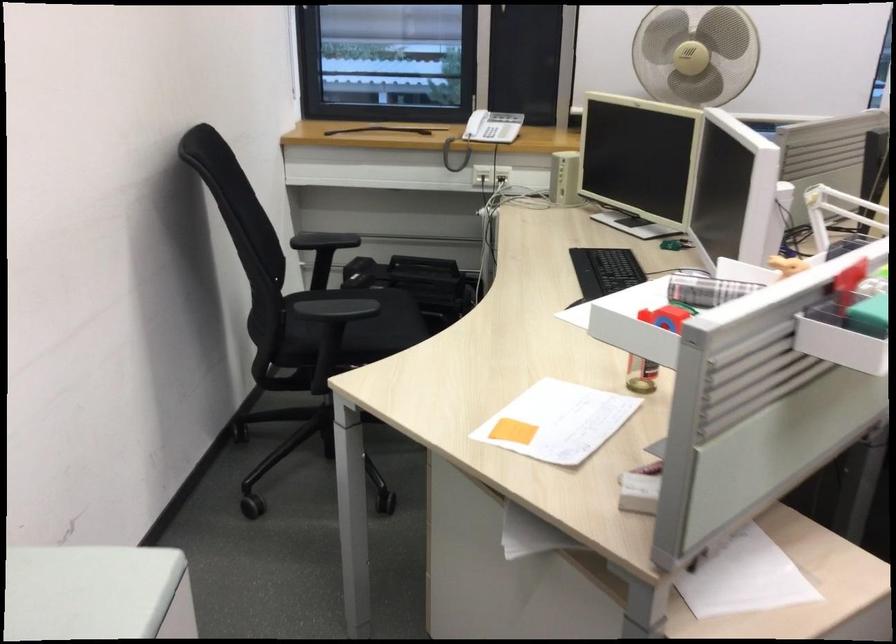
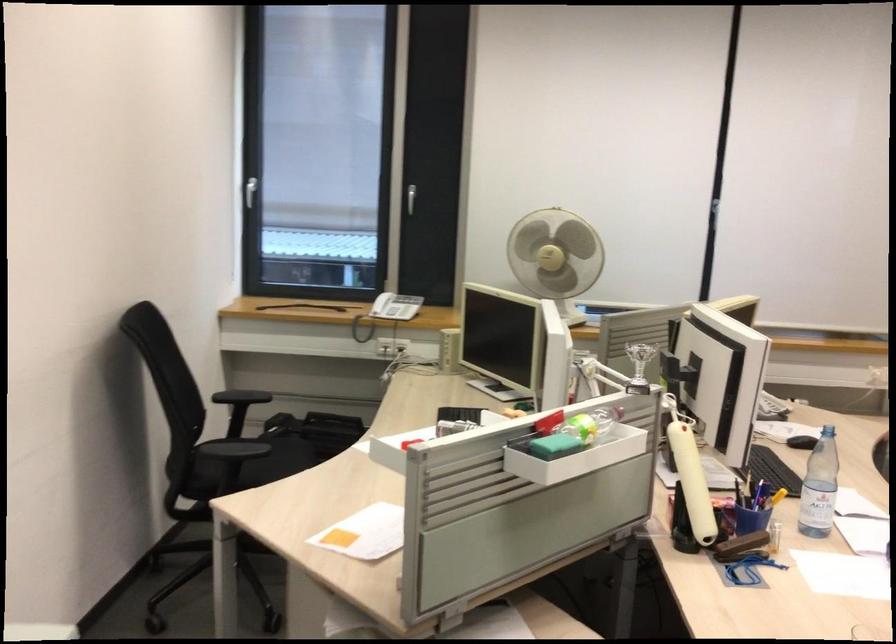
Where in the second image is the point corresponding to [483,135] from the first image?

(386, 312)